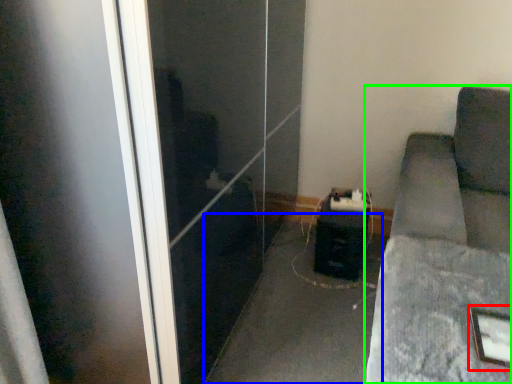
Question: Considering the real-world distances, which object is closest to picture frame (highlighted by a red box)? concrete (highlighted by a blue box) or furniture (highlighted by a green box).

Choices:
 (A) concrete
 (B) furniture

Answer: (B)